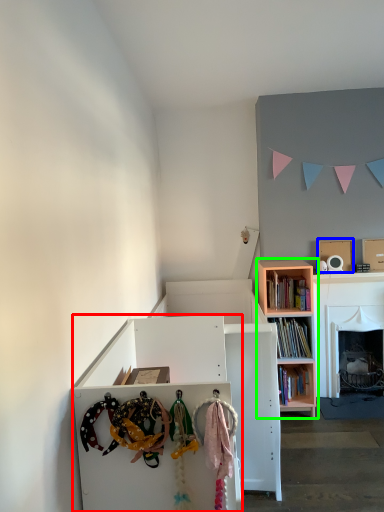
Question: Which is nearer to the cabinetry (highlighted by a red box)? cardboard box (highlighted by a blue box) or bookcase (highlighted by a green box).

Choices:
 (A) cardboard box
 (B) bookcase

Answer: (B)